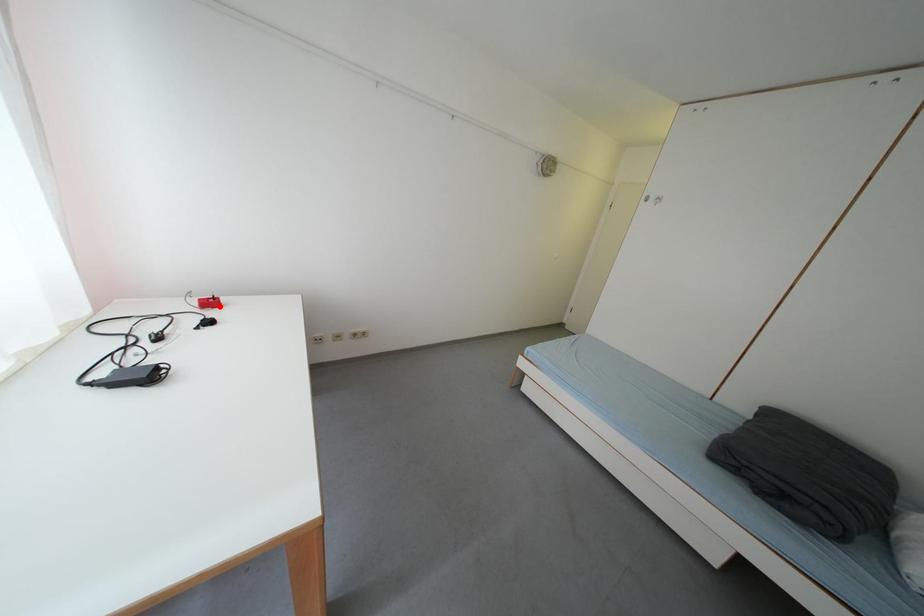
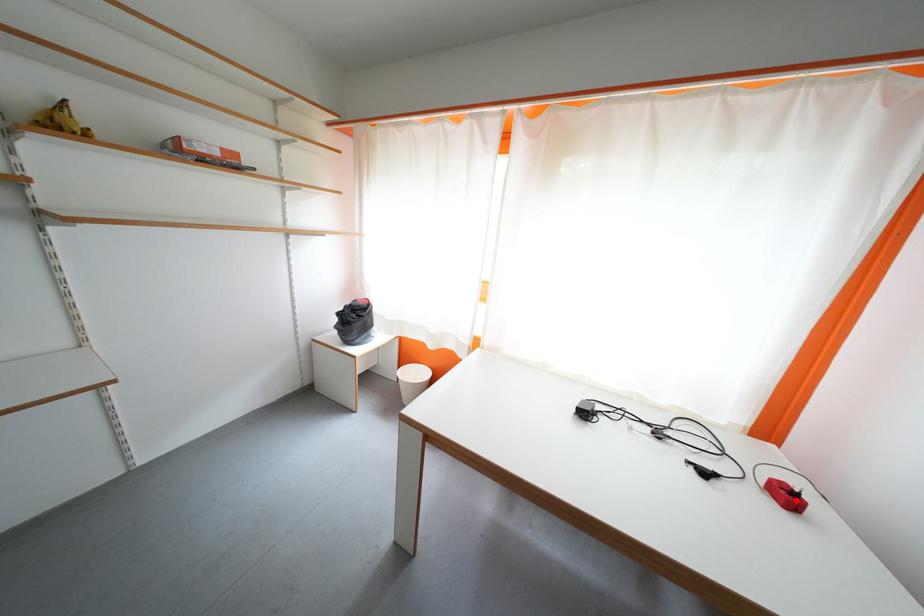
I am providing you with two images of the same scene from different viewpoints. A red point is marked on the first image and another point is marked on the second image. Do the highlighted points in image1 and image2 indicate the same real-world spot?

Yes